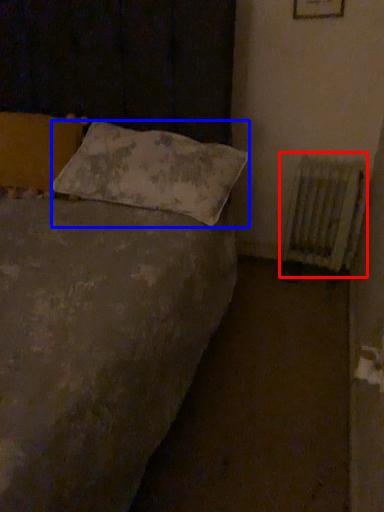
Question: Which object appears closest to the camera in this image, radiator (highlighted by a red box) or pillow (highlighted by a blue box)?

Choices:
 (A) radiator
 (B) pillow

Answer: (B)